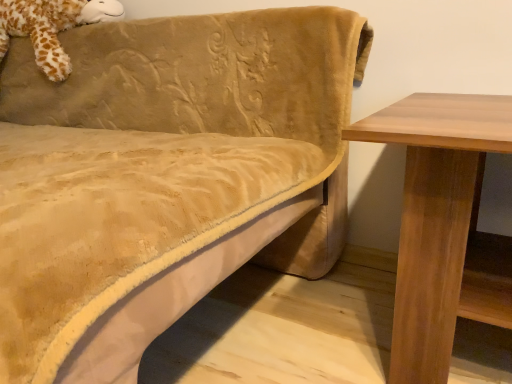
Where is `velvet beige couch at upper left`? The width and height of the screenshot is (512, 384). velvet beige couch at upper left is located at coordinates (157, 173).

This screenshot has width=512, height=384. What do you see at coordinates (157, 173) in the screenshot? I see `velvet beige couch at upper left` at bounding box center [157, 173].

Measure the distance between fluffy brown giraffe at upper left and camera.

fluffy brown giraffe at upper left and camera are 4.36 feet apart from each other.

Describe the element at coordinates (51, 27) in the screenshot. I see `fluffy brown giraffe at upper left` at that location.

At what (x,y) coordinates should I click in order to perform the action: click on fluffy brown giraffe at upper left. Please return your answer as a coordinate pair (x, y). Image resolution: width=512 pixels, height=384 pixels. Looking at the image, I should click on (51, 27).

Identify the location of velvet beige couch at upper left. (157, 173).

Which is more to the right, fluffy brown giraffe at upper left or velvet beige couch at upper left?

velvet beige couch at upper left is more to the right.

Relative to velvet beige couch at upper left, is fluffy brown giraffe at upper left in front or behind?

fluffy brown giraffe at upper left is behind velvet beige couch at upper left.

Which is closer to the camera, (42, 17) or (348, 13)?

Clearly, point (42, 17) is more distant from the camera than point (348, 13).

From the image's perspective, who appears lower, fluffy brown giraffe at upper left or velvet beige couch at upper left?

velvet beige couch at upper left.

From a real-world perspective, is fluffy brown giraffe at upper left physically above velvet beige couch at upper left?

Correct, in the physical world, fluffy brown giraffe at upper left is higher than velvet beige couch at upper left.

Is fluffy brown giraffe at upper left thinner than velvet beige couch at upper left?

Yes.

Looking at this image, which of these two, fluffy brown giraffe at upper left or velvet beige couch at upper left, stands shorter?

With less height is fluffy brown giraffe at upper left.

In terms of size, does fluffy brown giraffe at upper left appear bigger or smaller than velvet beige couch at upper left?

fluffy brown giraffe at upper left is smaller than velvet beige couch at upper left.

Is fluffy brown giraffe at upper left spatially inside velvet beige couch at upper left, or outside of it?

fluffy brown giraffe at upper left can be found inside velvet beige couch at upper left.

Is fluffy brown giraffe at upper left not close to velvet beige couch at upper left?

They are positioned close to each other.

Is fluffy brown giraffe at upper left looking in the opposite direction of velvet beige couch at upper left?

Yes, velvet beige couch at upper left is at the back of fluffy brown giraffe at upper left.

How many degrees apart are the facing directions of fluffy brown giraffe at upper left and velvet beige couch at upper left?

They differ by 1.03 degrees in their facing directions.

This screenshot has width=512, height=384. What are the coordinates of `animal that is above the velvet beige couch at upper left (from the image's perspective)` in the screenshot? It's located at (51, 27).

Visually, is velvet beige couch at upper left positioned to the left or to the right of fluffy brown giraffe at upper left?

Clearly, velvet beige couch at upper left is on the right of fluffy brown giraffe at upper left in the image.

Is the position of velvet beige couch at upper left more distant than that of fluffy brown giraffe at upper left?

No, the depth of velvet beige couch at upper left is less than that of fluffy brown giraffe at upper left.

Does point (0, 301) appear closer or farther from the camera than point (92, 14)?

Point (0, 301) appears to be closer to the viewer than point (92, 14).

From the image's perspective, is velvet beige couch at upper left above or below fluffy brown giraffe at upper left?

From the image's perspective, velvet beige couch at upper left appears below fluffy brown giraffe at upper left.

From a real-world perspective, does velvet beige couch at upper left sit lower than fluffy brown giraffe at upper left?

Yes.

Is velvet beige couch at upper left wider than fluffy brown giraffe at upper left?

Correct, the width of velvet beige couch at upper left exceeds that of fluffy brown giraffe at upper left.

Does velvet beige couch at upper left have a greater height compared to fluffy brown giraffe at upper left?

Indeed, velvet beige couch at upper left has a greater height compared to fluffy brown giraffe at upper left.

Between velvet beige couch at upper left and fluffy brown giraffe at upper left, which one has smaller size?

With smaller size is fluffy brown giraffe at upper left.

Can we say velvet beige couch at upper left lies outside fluffy brown giraffe at upper left?

Indeed, velvet beige couch at upper left is completely outside fluffy brown giraffe at upper left.

Are velvet beige couch at upper left and fluffy brown giraffe at upper left located far from each other?

velvet beige couch at upper left is near fluffy brown giraffe at upper left, not far away.

Is velvet beige couch at upper left facing towards fluffy brown giraffe at upper left?

No.

Measure the distance between velvet beige couch at upper left and fluffy brown giraffe at upper left.

velvet beige couch at upper left is 14.92 inches from fluffy brown giraffe at upper left.

Where is `animal that appears behind the velvet beige couch at upper left`? This screenshot has width=512, height=384. animal that appears behind the velvet beige couch at upper left is located at coordinates (51, 27).

Where is `studio couch in front of the fluffy brown giraffe at upper left`? studio couch in front of the fluffy brown giraffe at upper left is located at coordinates (157, 173).

I want to click on studio couch on the right of fluffy brown giraffe at upper left, so click(157, 173).